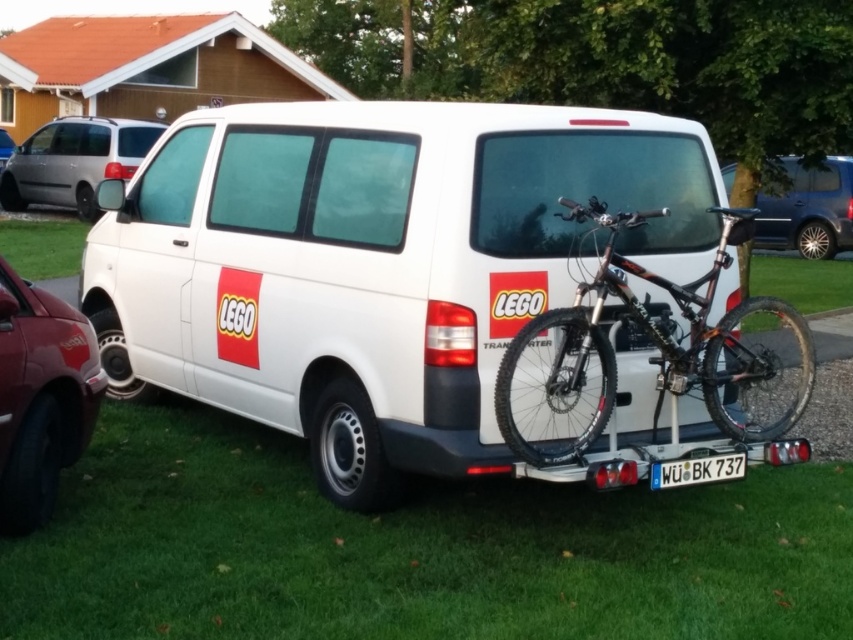
Question: Among these points, which one is nearest to the camera?

Choices:
 (A) (787, 356)
 (B) (529, 156)
 (C) (146, 129)

Answer: (B)

Question: Considering the real-world distances, which object is closest to the white plastic license plate at lower center?

Choices:
 (A) white matte van at center
 (B) metallic blue minivan at upper right
 (C) shiny metallic bicycle at rear
 (D) metallic silver car at upper left

Answer: (C)

Question: Can you confirm if shiny metallic bicycle at rear is positioned above metallic silver car at upper left?

Choices:
 (A) no
 (B) yes

Answer: (A)

Question: Can you confirm if white matte van at center is positioned above shiny metallic bicycle at rear?

Choices:
 (A) no
 (B) yes

Answer: (B)

Question: Is metallic blue minivan at upper right to the left of metallic silver car at upper left from the viewer's perspective?

Choices:
 (A) no
 (B) yes

Answer: (A)

Question: Among these objects, which one is farthest from the camera?

Choices:
 (A) satin silver van at upper left
 (B) white plastic license plate at lower center

Answer: (A)